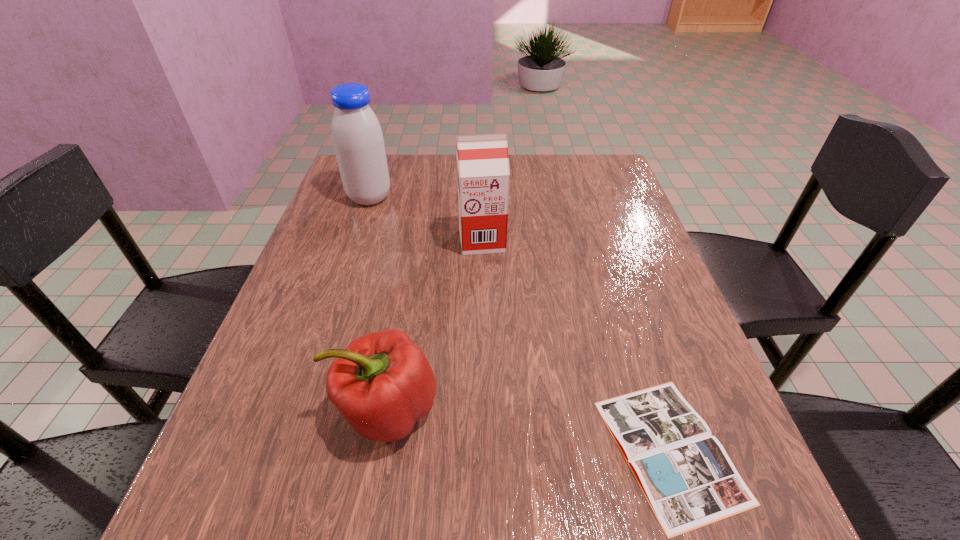
Where is `vacant area at the right edge`? vacant area at the right edge is located at coordinates (598, 268).

At what (x,y) coordinates should I click in order to perform the action: click on vacant point located between the farther soya milk and the bell pepper. Please return your answer as a coordinate pair (x, y). Image resolution: width=960 pixels, height=540 pixels. Looking at the image, I should click on (378, 304).

Identify the location of unoccupied area between the farther soya milk and the third tallest object. (378, 304).

Image resolution: width=960 pixels, height=540 pixels. Find the location of `vacant space that's between the rightmost object and the bell pepper`. vacant space that's between the rightmost object and the bell pepper is located at coordinates (528, 430).

At what (x,y) coordinates should I click in order to perform the action: click on vacant space in between the left soya milk and the second farthest object. Please return your answer as a coordinate pair (x, y). Looking at the image, I should click on (425, 219).

This screenshot has width=960, height=540. In order to click on free spot between the rightmost object and the third nearest object in this screenshot , I will do `click(576, 345)`.

Where is `vacant area that lies between the bell pepper and the shortest object`? This screenshot has width=960, height=540. vacant area that lies between the bell pepper and the shortest object is located at coordinates (528, 430).

Find the location of a particular element. The height and width of the screenshot is (540, 960). vacant space that's between the book and the farther soya milk is located at coordinates (519, 324).

Where is `vacant space that is in between the left soya milk and the bell pepper`? This screenshot has height=540, width=960. vacant space that is in between the left soya milk and the bell pepper is located at coordinates (378, 304).

The width and height of the screenshot is (960, 540). I want to click on blank region between the book and the farther soya milk, so click(x=519, y=324).